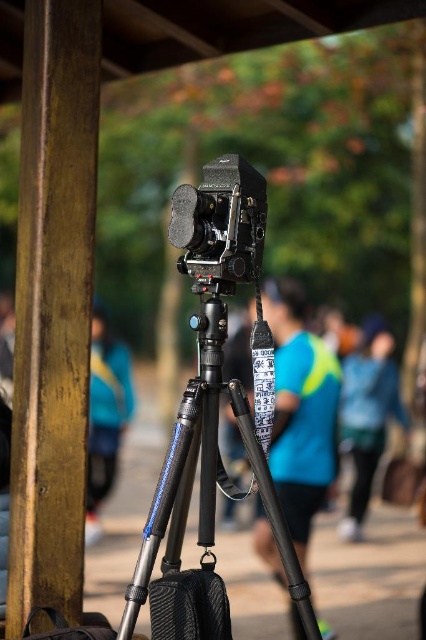
Does blue fabric shirt at center have a lesser height compared to matte black camera at center?

In fact, blue fabric shirt at center may be taller than matte black camera at center.

Can you confirm if blue fabric shirt at center is bigger than matte black camera at center?

Correct, blue fabric shirt at center is larger in size than matte black camera at center.

Who is more forward, (x=276, y=317) or (x=227, y=260)?

Point (x=227, y=260) is more forward.

The width and height of the screenshot is (426, 640). In order to click on blue fabric shirt at center in this screenshot , I will do coord(301,410).

Find the location of a particular element. The image size is (426, 640). wooden pole at left is located at coordinates (52, 307).

Can you confirm if wooden pole at left is wider than blue fabric bag at left?

No.

This screenshot has width=426, height=640. Identify the location of wooden pole at left. (x=52, y=307).

Image resolution: width=426 pixels, height=640 pixels. What are the coordinates of `wooden pole at left` in the screenshot? It's located at (52, 307).

Which is more to the left, metallic tripod at center or blue fabric shirt at center?

Positioned to the left is metallic tripod at center.

Is metallic tripod at center further to the viewer compared to blue fabric shirt at center?

No, it is not.

Which is behind, point (178, 506) or point (264, 304)?

Point (264, 304)

Locate an element on the screen. This screenshot has height=640, width=426. metallic tripod at center is located at coordinates (204, 506).